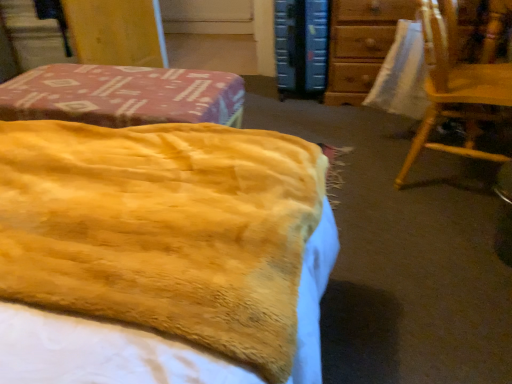
This screenshot has height=384, width=512. I want to click on vacant space to the left of wooden chair at right, so click(x=359, y=180).